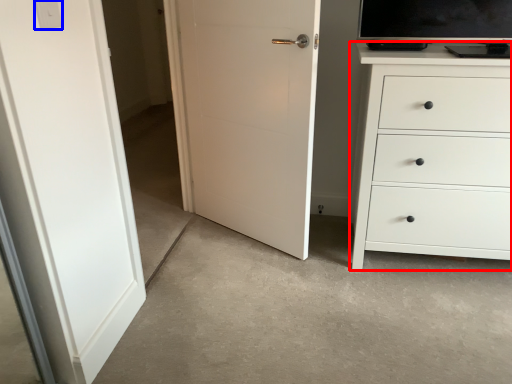
Question: Which point is further to the camera, chest of drawers (highlighted by a red box) or light switch (highlighted by a blue box)?

Choices:
 (A) chest of drawers
 (B) light switch

Answer: (A)